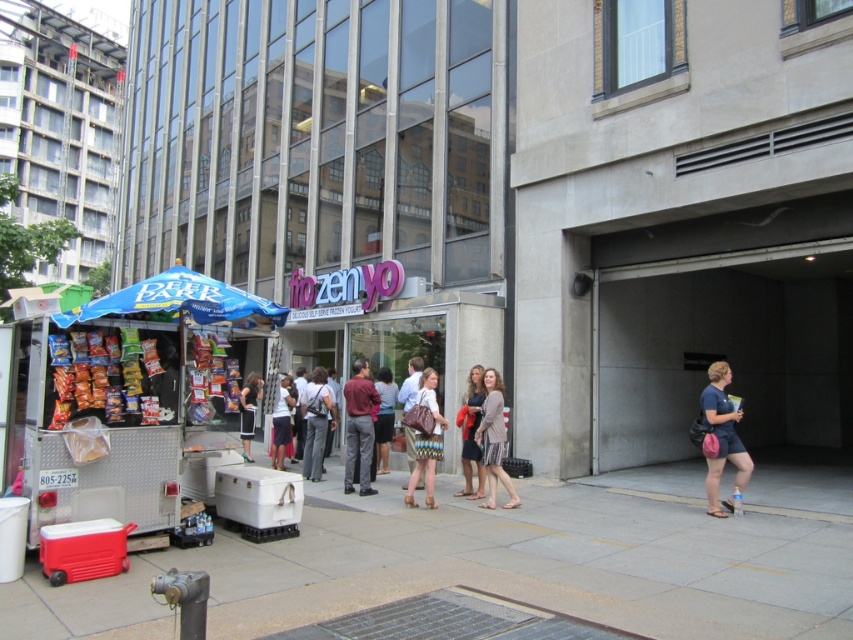
You are a customer at the urban street scene and need to choose between placing a large bag or a small bag in the space between the light brown fabric dress at center and the matte brown purse at center. Which one can fit better?

The light brown fabric dress at center is wider than the matte brown purse at center, so the large bag can fit better in the space between them.

You are a customer looking to purchase a light brown fabric dress at center and a matte brown purse at center. The salesperson says both items are available but mentions that the dress is currently on a display rack. Can you tell me which item is physically closer to you based on their positions?

The light brown fabric dress at center is in front of the matte brown purse at center, so the dress is closer to you.